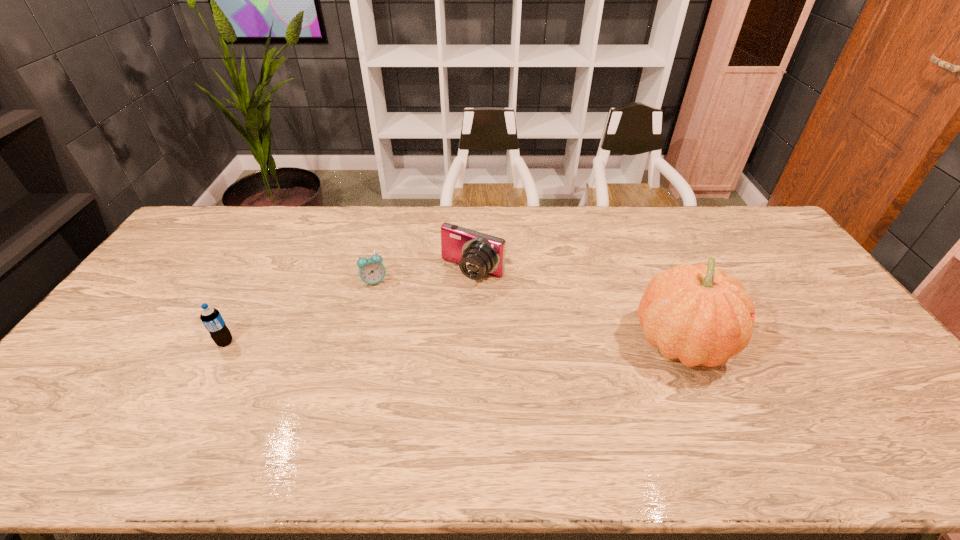
The width and height of the screenshot is (960, 540). I want to click on free spot on the desktop that is between the leftmost object and the tallest object and is positioned on the front-facing side of the camera, so click(x=420, y=342).

This screenshot has width=960, height=540. Identify the location of vacant space on the desktop that is between the soda bottle and the pumpkin and is positioned on the face of the alarm clock. (421, 342).